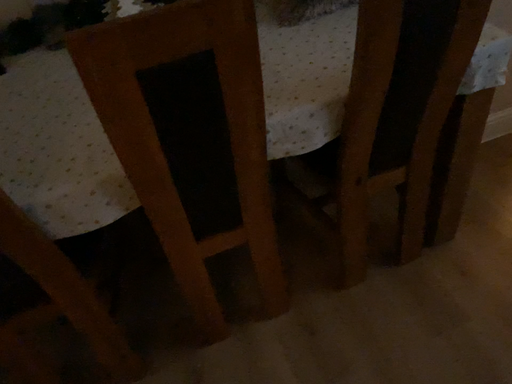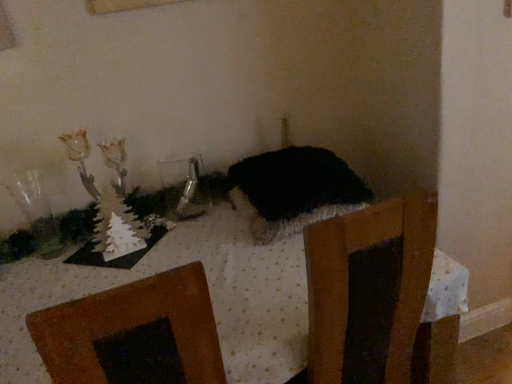
Question: How did the camera likely rotate when shooting the video?

Choices:
 (A) rotated upward
 (B) rotated downward

Answer: (A)